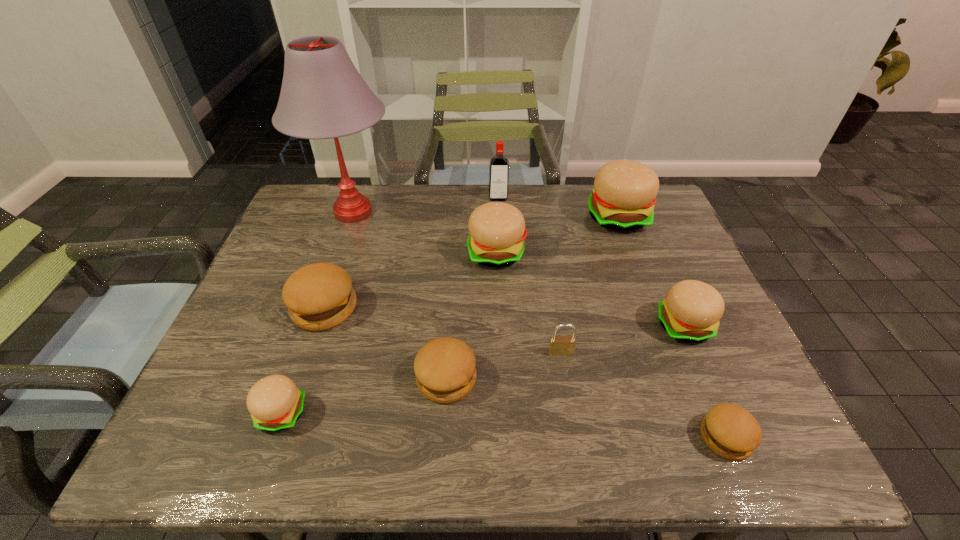
Locate an element on the screen. The height and width of the screenshot is (540, 960). hamburger identified as the sixth closest to the light table lamp is located at coordinates (691, 311).

Image resolution: width=960 pixels, height=540 pixels. What are the coordinates of `the sixth closest hamburger to the biggest beige hamburger` in the screenshot? It's located at (275, 403).

Locate an element on the screen. This screenshot has width=960, height=540. beige hamburger that is the fourth closest one to the table lamp is located at coordinates click(x=691, y=311).

Where is `beige hamburger that stands as the third closest to the biggest beige hamburger`? Image resolution: width=960 pixels, height=540 pixels. beige hamburger that stands as the third closest to the biggest beige hamburger is located at coordinates (275, 403).

The width and height of the screenshot is (960, 540). Identify the location of the closest brown hamburger to the biggest brown hamburger. coord(445,368).

Locate an element on the screen. The height and width of the screenshot is (540, 960). brown hamburger that is the third nearest to the smallest beige hamburger is located at coordinates (730, 431).

Where is `vacant region that satisfies the following two spatial constraints: 1. on the front-facing side of the light table lamp; 2. on the right side of the second tallest hamburger`? vacant region that satisfies the following two spatial constraints: 1. on the front-facing side of the light table lamp; 2. on the right side of the second tallest hamburger is located at coordinates (339, 253).

Find the location of `vacant region that satisfies the following two spatial constraints: 1. on the front-facing side of the padlock; 2. on the left side of the smallest brown hamburger`. vacant region that satisfies the following two spatial constraints: 1. on the front-facing side of the padlock; 2. on the left side of the smallest brown hamburger is located at coordinates [574, 437].

The width and height of the screenshot is (960, 540). Find the location of `free space that satisfies the following two spatial constraints: 1. on the front and back of the red vodka; 2. on the left side of the third farthest beige hamburger`. free space that satisfies the following two spatial constraints: 1. on the front and back of the red vodka; 2. on the left side of the third farthest beige hamburger is located at coordinates (505, 326).

I want to click on free spot that satisfies the following two spatial constraints: 1. on the front-facing side of the third biggest beige hamburger; 2. on the left side of the light table lamp, so click(313, 326).